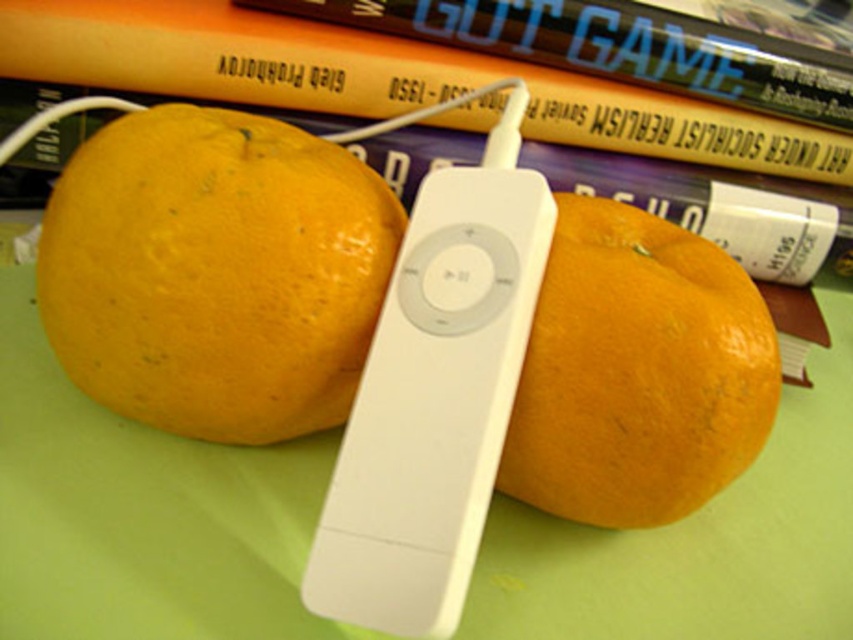
What is the color and texture of the object located at coordinates point (215, 273) in the image?

The point (215, 273) marks yellow matte or orange at center.

You are trying to locate the white plastic remote at center. According to the coordinates provided, where exactly is it placed?

The white plastic remote at center is located at point 0.634 on the x axis and 0.508 on the y axis.